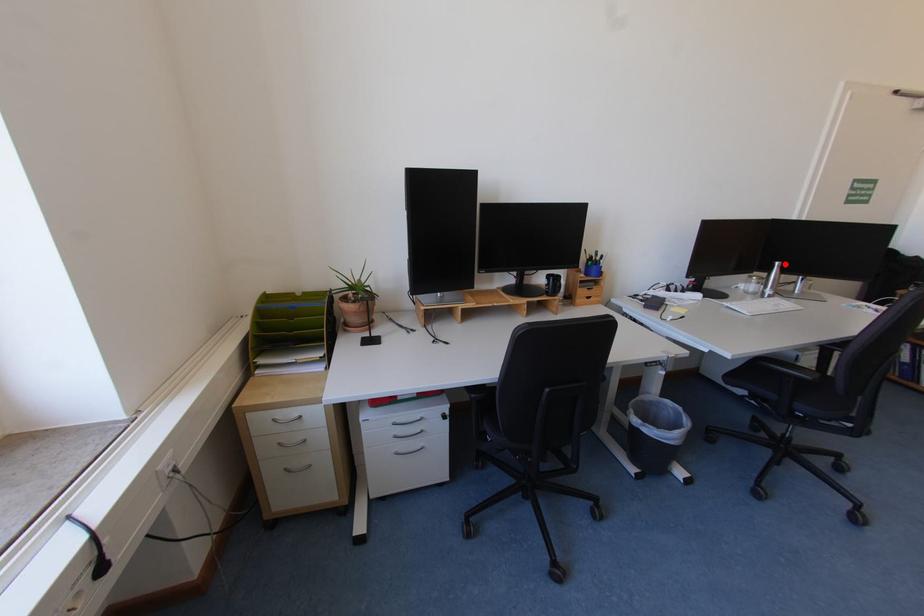
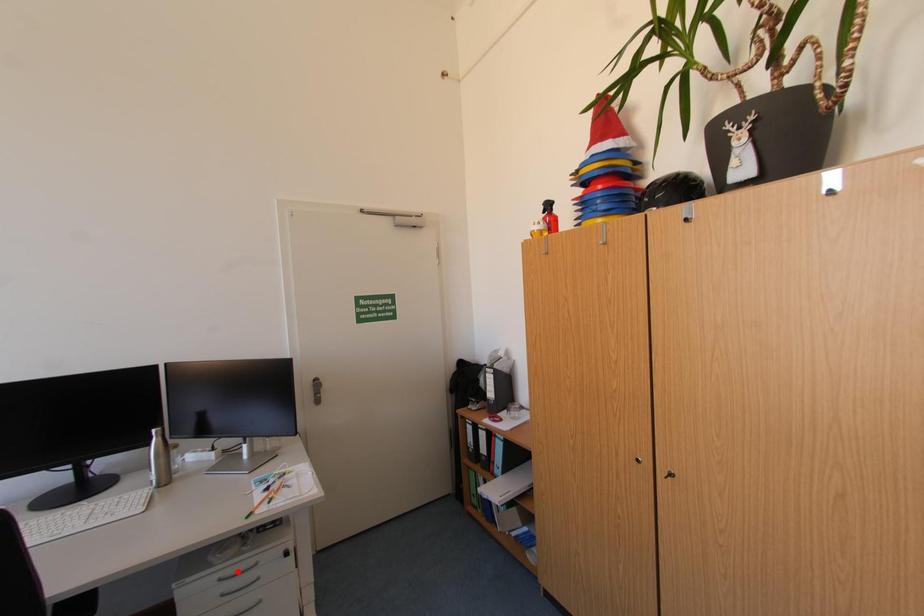
I am providing you with two images of the same scene from different viewpoints. A red point is marked on the first image and another point is marked on the second image. Is the marked point in image1 the same physical position as the marked point in image2?

No